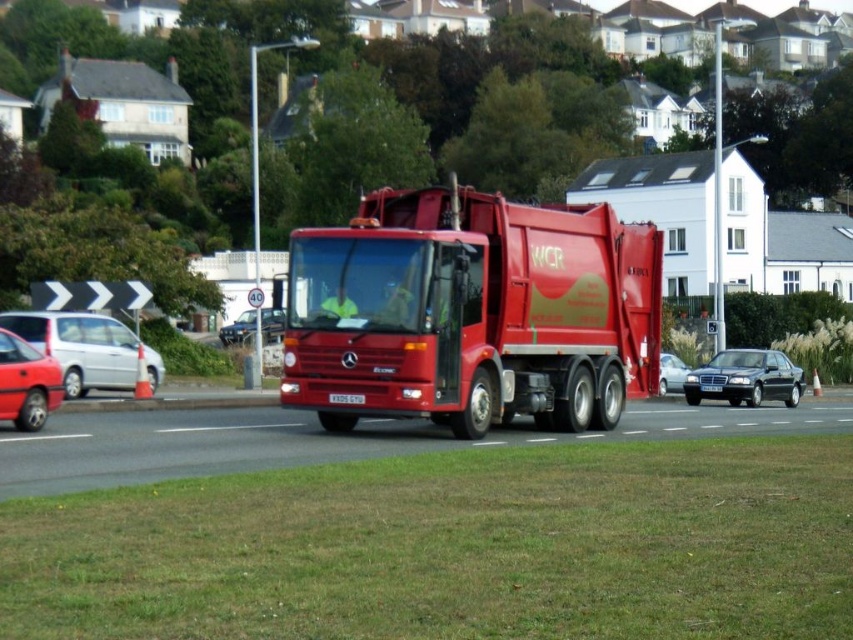
You are a pedestrian standing on the grassy area in front of the road. You see the shiny red truck at center and the silver metallic van at left. Which vehicle is closer to you?

The shiny red truck at center is closer to you because it is in front of the silver metallic van at left.